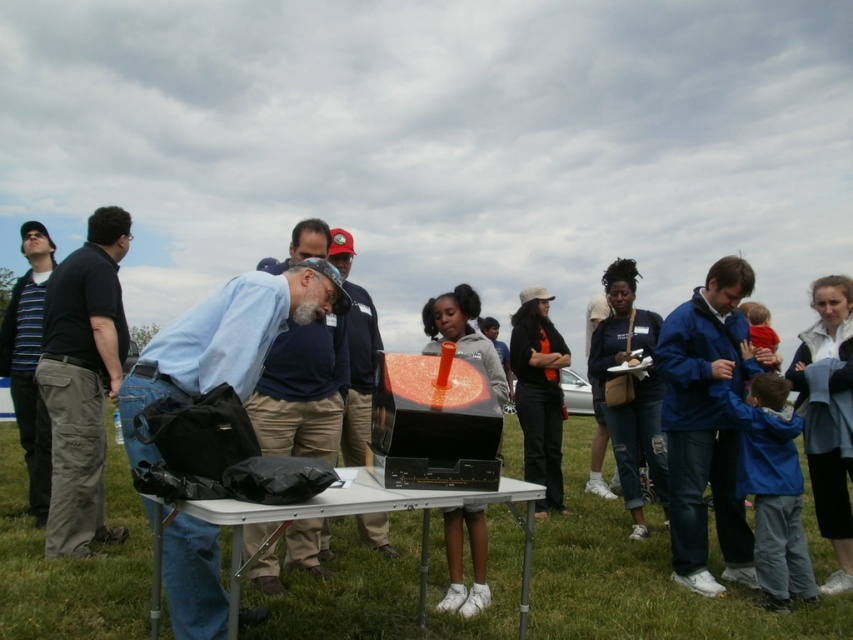
Question: Which point is closer to the camera taking this photo?

Choices:
 (A) (216, 296)
 (B) (74, 429)

Answer: (A)

Question: Does white plastic table at center appear under matte blue shirt at center?

Choices:
 (A) yes
 (B) no

Answer: (A)

Question: Does dark gray pants at left come in front of blue shirt at center?

Choices:
 (A) yes
 (B) no

Answer: (B)

Question: Which object is positioned closest to the striped knit sweater at left?

Choices:
 (A) blue fabric jacket at right
 (B) dark gray pants at left
 (C) blue fabric shirt at center

Answer: (B)

Question: Estimate the real-world distances between objects in this image. Which object is farther from the blue fabric shirt at center?

Choices:
 (A) blue fabric jacket at right
 (B) matte blue shirt at center
 (C) striped knit sweater at left

Answer: (C)

Question: Does blue fabric jacket at right have a larger size compared to matte blue shirt at center?

Choices:
 (A) yes
 (B) no

Answer: (A)